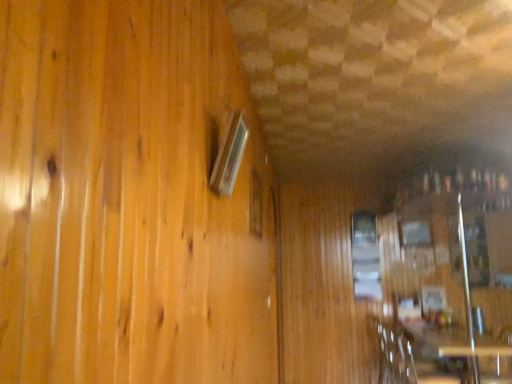
I want to click on wooden armchair at lower right, so click(x=395, y=353).

Locate an element on the screen. matte glass window at upper left, which is the third window from bottom to top is located at coordinates (229, 156).

Measure the distance between point (458, 379) and camera.

They are 4.02 meters apart.

What do you see at coordinates (456, 357) in the screenshot? I see `wooden table at lower right, which is the first table in front-to-back order` at bounding box center [456, 357].

Identify the location of clear glass window at center, arranged as the 1th window when viewed from the back. This screenshot has width=512, height=384. (365, 256).

The width and height of the screenshot is (512, 384). Describe the element at coordinates (483, 362) in the screenshot. I see `transparent glass table at lower right, the second table positioned from the front` at that location.

Measure the distance between transparent glass table at lower right, marked as the first table in a back-to-front arrangement, and camera.

transparent glass table at lower right, marked as the first table in a back-to-front arrangement, and camera are 12.58 feet apart from each other.

This screenshot has height=384, width=512. I want to click on wooden armchair at lower right, so click(x=395, y=353).

How many degrees apart are the facing directions of clear glass window at center, the 3th window in the left-to-right sequence, and clear glass window at upper center, which ranks as the second window in bottom-to-top order?

They differ by 91.5 degrees in their facing directions.

From a real-world perspective, is clear glass window at center, arranged as the 1th window when viewed from the back, physically below clear glass window at upper center, which is counted as the 2th window, starting from the back?

Result: Yes.

Is clear glass window at center, which appears as the third window when viewed from the top, inside the boundaries of clear glass window at upper center, arranged as the second window when viewed from the top, or outside?

clear glass window at center, which appears as the third window when viewed from the top, is located beyond the bounds of clear glass window at upper center, arranged as the second window when viewed from the top.

Can you confirm if clear glass window at center, which is the first window from right to left, is wider than clear glass window at upper center, arranged as the second window when viewed from the top?

In fact, clear glass window at center, which is the first window from right to left, might be narrower than clear glass window at upper center, arranged as the second window when viewed from the top.

Is matte glass window at upper left, the first window when ordered from left to right, shorter than wooden armchair at lower right?

Correct, matte glass window at upper left, the first window when ordered from left to right, is not as tall as wooden armchair at lower right.

Who is smaller, matte glass window at upper left, which is counted as the first window, starting from the front, or wooden armchair at lower right?

With smaller size is matte glass window at upper left, which is counted as the first window, starting from the front.

From the picture: From the image's perspective, does matte glass window at upper left, which is the third window from bottom to top, appear lower than wooden armchair at lower right?

Actually, matte glass window at upper left, which is the third window from bottom to top, appears above wooden armchair at lower right in the image.

Is transparent glass table at lower right, the second table positioned from the front, situated inside wooden armchair at lower right or outside?

transparent glass table at lower right, the second table positioned from the front, is outside wooden armchair at lower right.

In the scene shown: Is transparent glass table at lower right, marked as the first table in a back-to-front arrangement, not close to wooden armchair at lower right?

No, there isn't a large distance between transparent glass table at lower right, marked as the first table in a back-to-front arrangement, and wooden armchair at lower right.

Measure the distance between transparent glass table at lower right, marked as the first table in a back-to-front arrangement, and wooden armchair at lower right.

transparent glass table at lower right, marked as the first table in a back-to-front arrangement, and wooden armchair at lower right are 22.89 inches apart from each other.

From a real-world perspective, relative to wooden armchair at lower right, is transparent glass table at lower right, marked as the first table in a back-to-front arrangement, vertically above or below?

In terms of real-world spatial position, transparent glass table at lower right, marked as the first table in a back-to-front arrangement, is above wooden armchair at lower right.

From the image's perspective, which one is positioned higher, wooden table at lower right, which is the first table in front-to-back order, or transparent glass table at lower right, marked as the first table in a back-to-front arrangement?

transparent glass table at lower right, marked as the first table in a back-to-front arrangement.

From a real-world perspective, is wooden table at lower right, marked as the second table in a back-to-front arrangement, physically located above or below transparent glass table at lower right, the second table positioned from the front?

wooden table at lower right, marked as the second table in a back-to-front arrangement, is below transparent glass table at lower right, the second table positioned from the front.

In the scene shown: Which of these two, wooden table at lower right, marked as the second table in a back-to-front arrangement, or transparent glass table at lower right, the second table positioned from the front, is smaller?

Smaller between the two is transparent glass table at lower right, the second table positioned from the front.

Considering the positions of points (457, 349) and (499, 347), is point (457, 349) closer to camera compared to point (499, 347)?

Yes, point (457, 349) is in front of point (499, 347).

Is wooden armchair at lower right facing towards matte glass window at upper left, the first window when ordered from left to right?

No, wooden armchair at lower right is not aimed at matte glass window at upper left, the first window when ordered from left to right.

In terms of height, does wooden armchair at lower right look taller or shorter compared to matte glass window at upper left, which is counted as the first window, starting from the front?

In the image, wooden armchair at lower right appears to be taller than matte glass window at upper left, which is counted as the first window, starting from the front.

In the scene shown: From the image's perspective, is wooden armchair at lower right above matte glass window at upper left, which is counted as the first window, starting from the front?

Incorrect, from the image's perspective, wooden armchair at lower right is lower than matte glass window at upper left, which is counted as the first window, starting from the front.

Considering the sizes of objects wooden table at lower right, marked as the second table in a back-to-front arrangement, and clear glass window at upper center, which appears as the 2th window when viewed from the right, in the image provided, who is shorter, wooden table at lower right, marked as the second table in a back-to-front arrangement, or clear glass window at upper center, which appears as the 2th window when viewed from the right,?

clear glass window at upper center, which appears as the 2th window when viewed from the right.

Looking at this image, how many degrees apart are the facing directions of wooden table at lower right, marked as the second table in a back-to-front arrangement, and clear glass window at upper center, arranged as the second window when viewed from the top?

There is a 92.2-degree angle between the facing directions of wooden table at lower right, marked as the second table in a back-to-front arrangement, and clear glass window at upper center, arranged as the second window when viewed from the top.

Is wooden table at lower right, marked as the second table in a back-to-front arrangement, at the right side of clear glass window at upper center, arranged as the second window when viewed from the top?

Yes.

Looking at this image, which point is more distant from viewer, (425, 332) or (258, 179)?

Point (425, 332)

From a real-world perspective, who is located higher, wooden table at lower right, marked as the second table in a back-to-front arrangement, or matte glass window at upper left, arranged as the first window when viewed from the top?

matte glass window at upper left, arranged as the first window when viewed from the top, is physically above.

Considering the relative positions of wooden table at lower right, which is the first table in front-to-back order, and matte glass window at upper left, the first window when ordered from left to right, in the image provided, is wooden table at lower right, which is the first table in front-to-back order, to the right of matte glass window at upper left, the first window when ordered from left to right, from the viewer's perspective?

Yes.

Can you confirm if wooden table at lower right, which is the first table in front-to-back order, is smaller than matte glass window at upper left, arranged as the first window when viewed from the top?

Actually, wooden table at lower right, which is the first table in front-to-back order, might be larger than matte glass window at upper left, arranged as the first window when viewed from the top.

From the image's perspective, starting from the clear glass window at center, arranged as the 1th window when viewed from the back, which window is the 1st one above? Please provide its 2D coordinates.

[(256, 206)]

Where is `armchair on the right of matte glass window at upper left, which is counted as the first window, starting from the front`? The height and width of the screenshot is (384, 512). armchair on the right of matte glass window at upper left, which is counted as the first window, starting from the front is located at coordinates (395, 353).

Based on their spatial positions, is wooden table at lower right, which is the first table in front-to-back order, or transparent glass table at lower right, marked as the first table in a back-to-front arrangement, closer to clear glass window at upper center, positioned as the second window in left-to-right order?

The object closer to clear glass window at upper center, positioned as the second window in left-to-right order, is wooden table at lower right, which is the first table in front-to-back order.

Considering their positions, is clear glass window at upper center, positioned as the second window in left-to-right order, positioned further to transparent glass table at lower right, the second table positioned from the front, than wooden armchair at lower right?

The object further to transparent glass table at lower right, the second table positioned from the front, is clear glass window at upper center, positioned as the second window in left-to-right order.

From the image, which object appears to be farther from matte glass window at upper left, the first window when ordered from left to right, clear glass window at center, which ranks as the third window in front-to-back order, or wooden armchair at lower right?

clear glass window at center, which ranks as the third window in front-to-back order, is positioned further to the anchor matte glass window at upper left, the first window when ordered from left to right.

Based on the photo, considering their positions, is clear glass window at upper center, which appears as the 2th window when viewed from the right, positioned closer to wooden armchair at lower right than matte glass window at upper left, which is counted as the third window, starting from the back?

Among the two, clear glass window at upper center, which appears as the 2th window when viewed from the right, is located nearer to wooden armchair at lower right.

Which object lies further to the anchor point clear glass window at center, which ranks as the third window in front-to-back order, transparent glass table at lower right, marked as the first table in a back-to-front arrangement, or matte glass window at upper left, which is counted as the first window, starting from the front?

matte glass window at upper left, which is counted as the first window, starting from the front, is positioned further to the anchor clear glass window at center, which ranks as the third window in front-to-back order.

Which object lies further to the anchor point clear glass window at upper center, the 2th window in the front-to-back sequence, matte glass window at upper left, the first window when ordered from left to right, or clear glass window at center, which is the first window from right to left?

The object further to clear glass window at upper center, the 2th window in the front-to-back sequence, is clear glass window at center, which is the first window from right to left.

From the image, which object appears to be farther from matte glass window at upper left, the first window when ordered from left to right, wooden table at lower right, which is the first table in front-to-back order, or wooden armchair at lower right?

Based on the image, wooden table at lower right, which is the first table in front-to-back order, appears to be further to matte glass window at upper left, the first window when ordered from left to right.

In the scene shown: Which object lies nearer to the anchor point wooden armchair at lower right, transparent glass table at lower right, the second table positioned from the front, or clear glass window at upper center, which is counted as the 2th window, starting from the back?

Among the two, transparent glass table at lower right, the second table positioned from the front, is located nearer to wooden armchair at lower right.

Identify the location of armchair located between transparent glass table at lower right, marked as the first table in a back-to-front arrangement, and clear glass window at center, arranged as the 1th window when viewed from the back, in the depth direction. The image size is (512, 384). (395, 353).

The image size is (512, 384). Find the location of `armchair located between clear glass window at upper center, arranged as the second window when viewed from the top, and wooden table at lower right, which is the first table in front-to-back order, in the left-right direction`. armchair located between clear glass window at upper center, arranged as the second window when viewed from the top, and wooden table at lower right, which is the first table in front-to-back order, in the left-right direction is located at coordinates (395, 353).

The height and width of the screenshot is (384, 512). I want to click on armchair located between clear glass window at upper center, the 2th window in the front-to-back sequence, and clear glass window at center, which is counted as the first window, starting from the bottom, in the depth direction, so click(395, 353).

The width and height of the screenshot is (512, 384). What are the coordinates of `table between wooden table at lower right, marked as the second table in a back-to-front arrangement, and clear glass window at center, which ranks as the third window in front-to-back order, from front to back` in the screenshot? It's located at (483, 362).